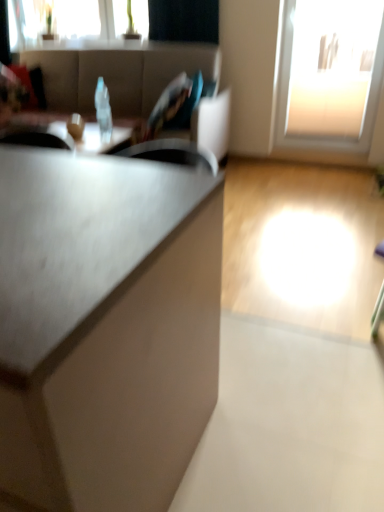
Question: Considering the relative sizes of transparent glass window at upper left, the 2th window positioned from the bottom, and transparent glass door at upper right, the 1th window positioned from the bottom, in the image provided, is transparent glass window at upper left, the 2th window positioned from the bottom, thinner than transparent glass door at upper right, the 1th window positioned from the bottom,?

Choices:
 (A) no
 (B) yes

Answer: (B)

Question: Is transparent glass window at upper left, the 2th window positioned from the bottom, taller than transparent glass door at upper right, which is the 2th window from left to right?

Choices:
 (A) no
 (B) yes

Answer: (A)

Question: Is transparent glass door at upper right, which is the 2th window from left to right, at the back of transparent glass window at upper left, acting as the 1th window starting from the top?

Choices:
 (A) no
 (B) yes

Answer: (A)

Question: From a real-world perspective, is transparent glass window at upper left, acting as the 1th window starting from the top, below transparent glass door at upper right, which is the second window in top-to-bottom order?

Choices:
 (A) yes
 (B) no

Answer: (B)

Question: Does transparent glass window at upper left, which is counted as the first window, starting from the left, come behind transparent glass door at upper right, the 1th window positioned from the bottom?

Choices:
 (A) no
 (B) yes

Answer: (B)

Question: Considering the positions of transparent glass door at upper right, acting as the 1th window starting from the right, and transparent glass window at upper left, acting as the 1th window starting from the top, in the image, is transparent glass door at upper right, acting as the 1th window starting from the right, bigger or smaller than transparent glass window at upper left, acting as the 1th window starting from the top,?

Choices:
 (A) big
 (B) small

Answer: (A)

Question: From the image's perspective, is transparent glass door at upper right, which is the second window in top-to-bottom order, positioned above or below transparent glass window at upper left, which is counted as the first window, starting from the left?

Choices:
 (A) below
 (B) above

Answer: (A)

Question: Is transparent glass door at upper right, which is the second window in top-to-bottom order, inside or outside of transparent glass window at upper left, the 2th window from the right?

Choices:
 (A) inside
 (B) outside

Answer: (B)

Question: Is transparent glass door at upper right, the 1th window positioned from the bottom, wider or thinner than transparent glass window at upper left, which is counted as the first window, starting from the left?

Choices:
 (A) wide
 (B) thin

Answer: (A)

Question: Relative to matte black table at center, is transparent glass door at upper right, acting as the 1th window starting from the right, in front or behind?

Choices:
 (A) behind
 (B) front

Answer: (A)

Question: Visually, is transparent glass door at upper right, which is the second window in top-to-bottom order, positioned to the left or to the right of matte black table at center?

Choices:
 (A) left
 (B) right

Answer: (B)

Question: From a real-world perspective, is transparent glass door at upper right, acting as the 1th window starting from the right, positioned above or below matte black table at center?

Choices:
 (A) below
 (B) above

Answer: (B)

Question: Is transparent glass door at upper right, the 1th window positioned from the bottom, inside or outside of matte black table at center?

Choices:
 (A) outside
 (B) inside

Answer: (A)

Question: Choose the correct answer: Is transparent glass window at upper left, acting as the 1th window starting from the top, inside transparent glass door at upper right, which is the 2th window from left to right, or outside it?

Choices:
 (A) inside
 (B) outside

Answer: (B)

Question: In terms of width, does transparent glass window at upper left, which is counted as the first window, starting from the left, look wider or thinner when compared to transparent glass door at upper right, which is the second window in top-to-bottom order?

Choices:
 (A) wide
 (B) thin

Answer: (B)